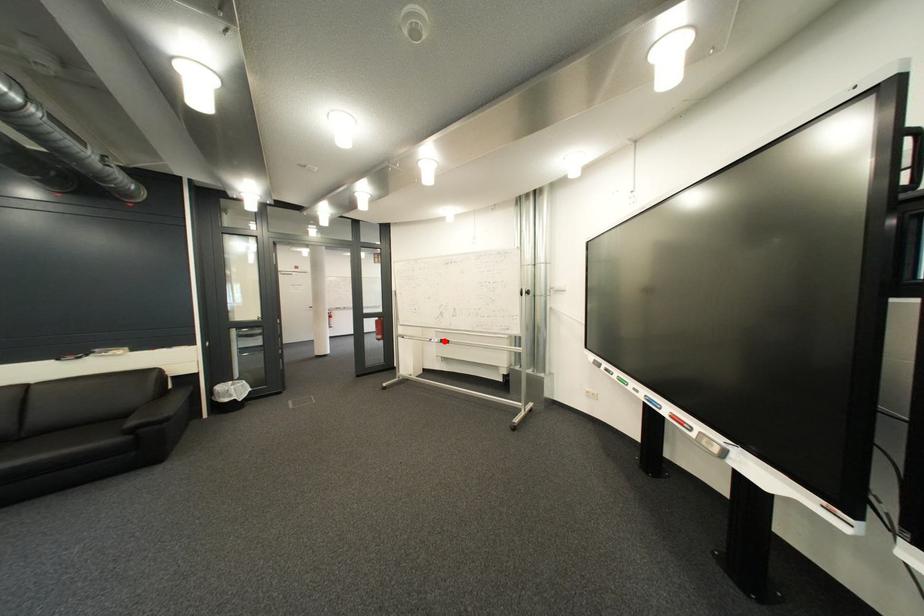
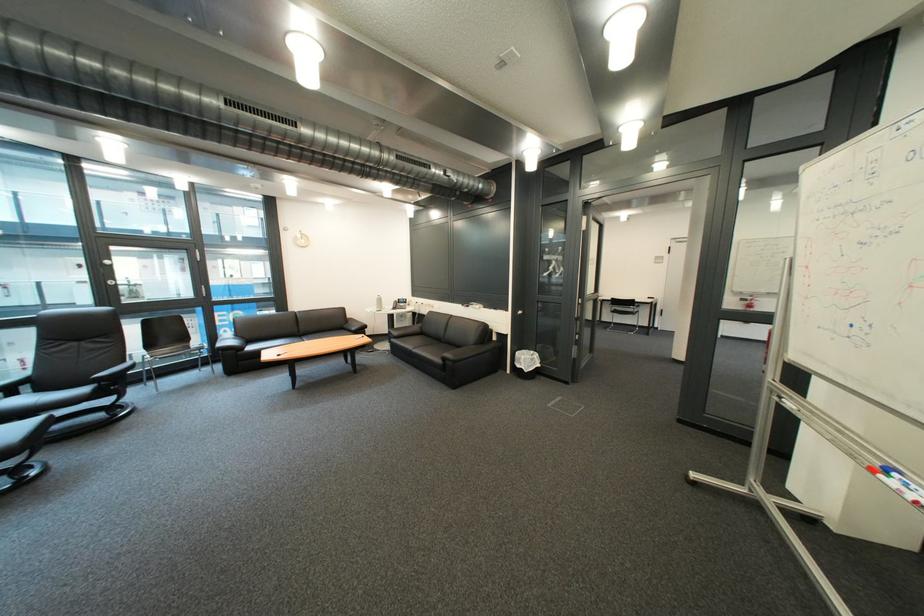
Question: A red point is marked in image1. In image2, is the corresponding 3D point closer to the camera or farther? Reply with the corresponding letter.

Choices:
 (A) The corresponding 3D point is closer.
 (B) The corresponding 3D point is farther.

Answer: (B)